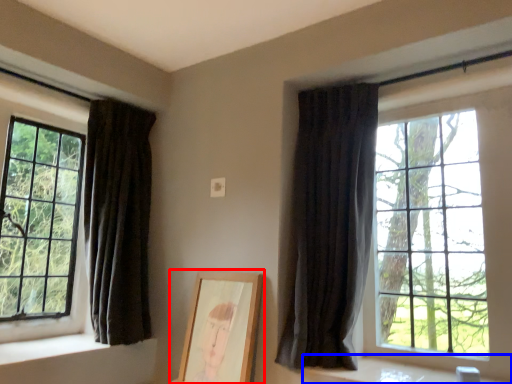
Question: Among these objects, which one is nearest to the camera, picture frame (highlighted by a red box) or window sill (highlighted by a blue box)?

Choices:
 (A) picture frame
 (B) window sill

Answer: (B)